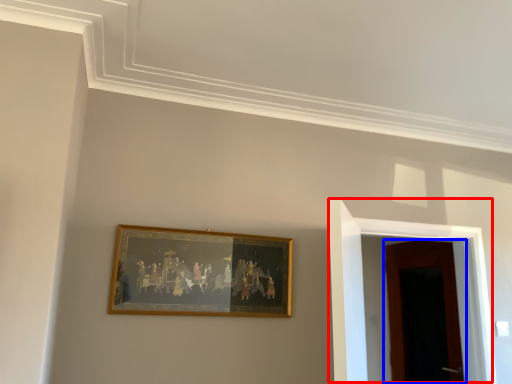
Question: Which object is closer to the camera taking this photo, door (highlighted by a red box) or door (highlighted by a blue box)?

Choices:
 (A) door
 (B) door

Answer: (A)